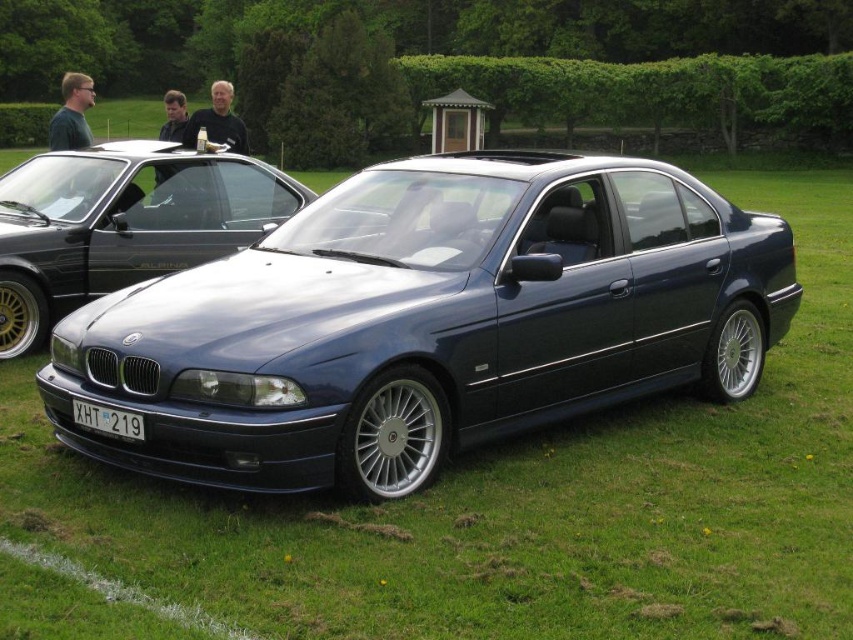
You are a parking attendant who needs to fit a car into a parking space that is exactly the same width as the black plastic license plate at center. Can the metallic blue sedan at center fit into this space?

The metallic blue sedan at center is wider than the black plastic license plate at center, so it cannot fit into the parking space that matches the license plate width.

You are standing at the origin point of the coordinate system. You want to walk towards the metallic blue sedan at center. In which direction should you walk?

The metallic blue sedan at center is located at point (427,321), which is northeast of the origin point. Therefore, you should walk in the northeast direction to reach it.

You are standing 10 feet away from the metallic blue sedan at center. If you walk straight towards it, will you have to move forward or backward to reach it?

The metallic blue sedan at center is 14.01 feet away from the camera. Since you are currently standing 10 feet away from it, you need to move forward 4.01 feet to reach the metallic blue sedan at center.